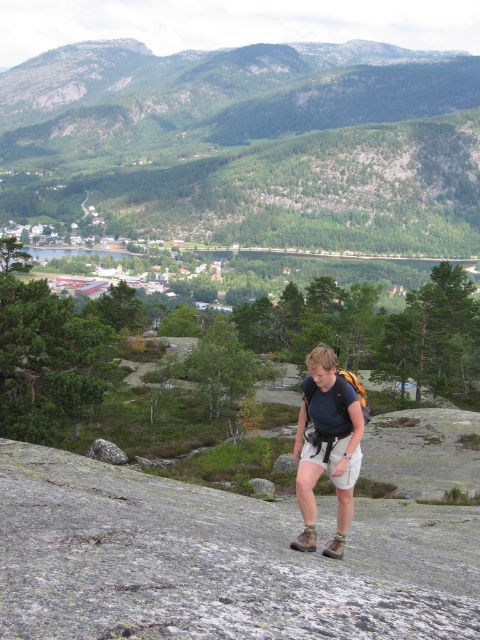
You are a hiker who just spotted the khaki cotton shorts at center and the smooth gray rock at center. Which object is higher in elevation?

The khaki cotton shorts at center is above the smooth gray rock at center, so the khaki cotton shorts at center is higher in elevation.